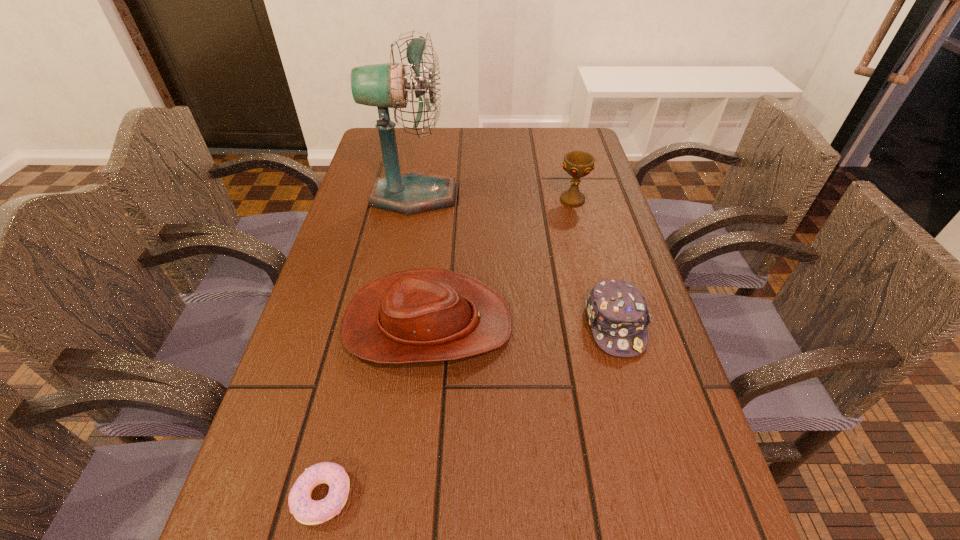
I want to click on fan, so click(384, 86).

The height and width of the screenshot is (540, 960). I want to click on the fourth shortest object, so click(x=577, y=164).

Identify the location of the third tallest object. This screenshot has width=960, height=540. (420, 315).

Find the location of `headwear`. headwear is located at coordinates (617, 311).

Find the location of a particular element. The image size is (960, 540). the nearest object is located at coordinates (305, 510).

Where is `the shortest object`? This screenshot has height=540, width=960. the shortest object is located at coordinates (305, 510).

At what (x,y) coordinates should I click in order to perform the action: click on vacant space located 0.240m in front of the fan where the wind blows. Please return your answer as a coordinate pair (x, y). This screenshot has height=540, width=960. Looking at the image, I should click on (540, 196).

You are a GUI agent. You are given a task and a screenshot of the screen. Output one action in this format:
    pyautogui.click(x=<x>, y=<y>)
    Task: Click on the vacant region located 0.340m on the left of the chalice
    
    Given the screenshot: What is the action you would take?
    pyautogui.click(x=436, y=199)

Identify the location of free space located on the front-facing side of the third shortest object. (593, 324).

Identify the location of blank area located 0.210m on the front-facing side of the fourth tallest object. (656, 469).